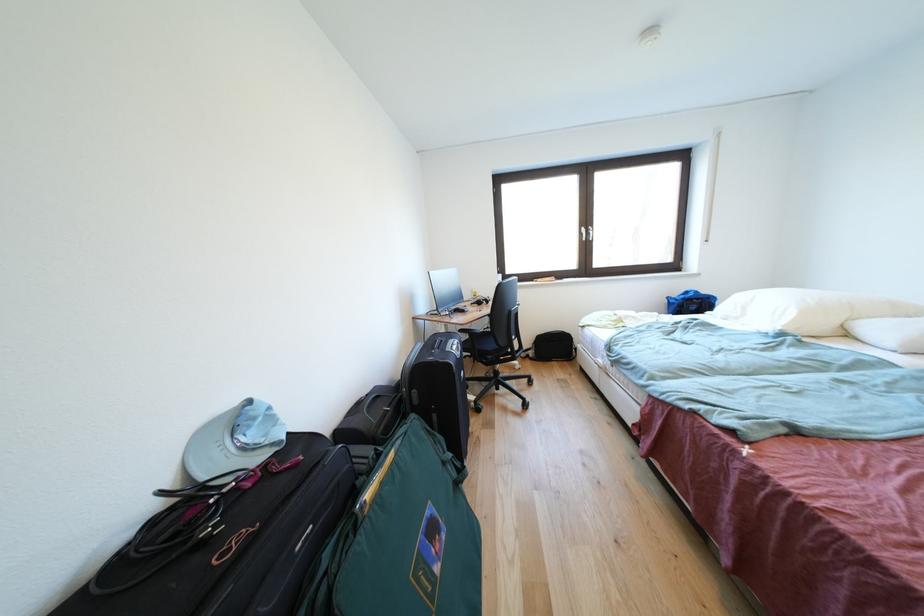
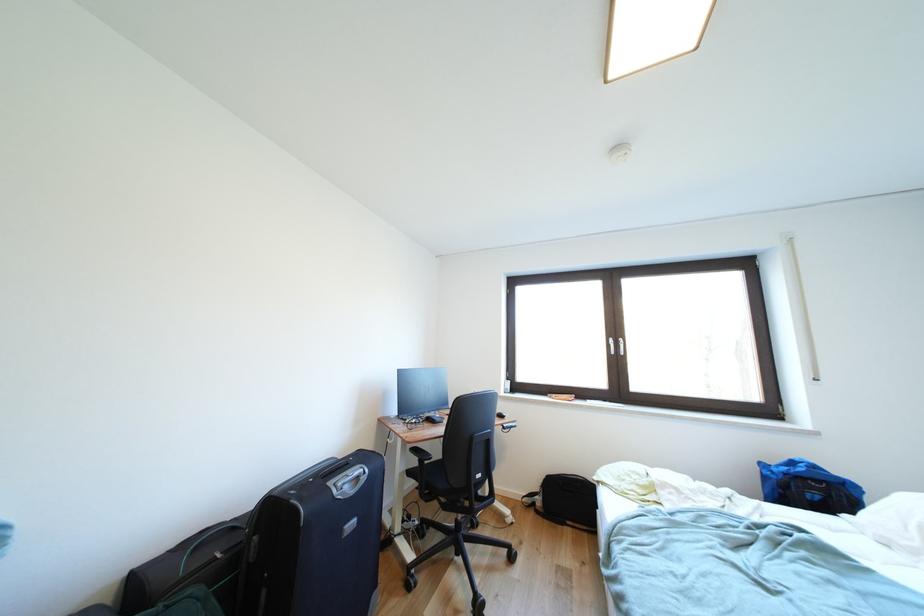
Based on the photo, the images are taken continuously from a first-person perspective. In which direction are you moving?

The cameraman walked toward right, forward.